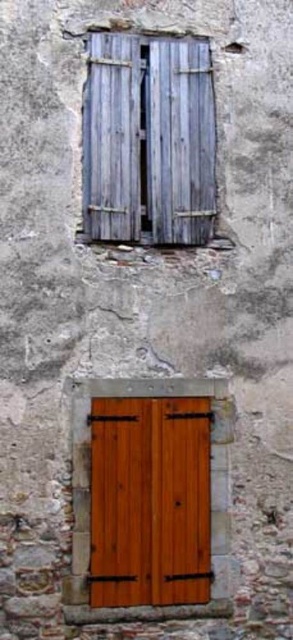
Question: In this image, where is weathered wood shutters at upper center located relative to wooden door at center?

Choices:
 (A) right
 (B) left

Answer: (B)

Question: Which point is farther to the camera?

Choices:
 (A) (135, 214)
 (B) (145, 506)

Answer: (A)

Question: Where is weathered wood shutters at upper center located in relation to wooden door at center in the image?

Choices:
 (A) right
 (B) left

Answer: (B)

Question: From the image, what is the correct spatial relationship of weathered wood shutters at upper center in relation to wooden door at center?

Choices:
 (A) below
 (B) above

Answer: (B)